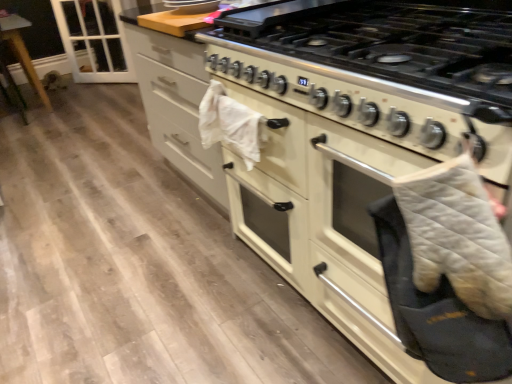
Measure the distance between point (368, 219) and camera.

They are 4.10 feet apart.

Image resolution: width=512 pixels, height=384 pixels. I want to click on gray quilted oven mitt at right, so click(457, 236).

What are the coordinates of `white glossy gas stove at center` in the screenshot? It's located at (389, 41).

Does white glossy gas stove at center have a lesser width compared to white quilted oven mitt at right?

No.

Considering the sizes of objects white glossy gas stove at center and white quilted oven mitt at right in the image provided, who is taller, white glossy gas stove at center or white quilted oven mitt at right?

Standing taller between the two is white quilted oven mitt at right.

Would you say white glossy gas stove at center is to the left or to the right of white quilted oven mitt at right in the picture?

From the image, it's evident that white glossy gas stove at center is to the right of white quilted oven mitt at right.

From the image's perspective, does white glossy gas stove at center appear higher than white quilted oven mitt at right?

Correct, white glossy gas stove at center appears higher than white quilted oven mitt at right in the image.

Could you tell me if transparent glass door at upper left is turned towards white quilted oven mitt at right?

No, transparent glass door at upper left is not aimed at white quilted oven mitt at right.

Considering the points (63, 11) and (371, 358), which point is in front, point (63, 11) or point (371, 358)?

The point (371, 358) is closer to the camera.

Is transparent glass door at upper left positioned far away from white quilted oven mitt at right?

Yes.

How far apart are transparent glass door at upper left and white quilted oven mitt at right?

A distance of 12.21 feet exists between transparent glass door at upper left and white quilted oven mitt at right.

Is gray quilted oven mitt at right far away from white quilted oven mitt at right?

No, there isn't a large distance between gray quilted oven mitt at right and white quilted oven mitt at right.

Considering the relative sizes of gray quilted oven mitt at right and white quilted oven mitt at right in the image provided, is gray quilted oven mitt at right taller than white quilted oven mitt at right?

No, gray quilted oven mitt at right is not taller than white quilted oven mitt at right.

Is transparent glass door at upper left turned away from white glossy gas stove at center?

transparent glass door at upper left is not turned away from white glossy gas stove at center.

From a real-world perspective, is transparent glass door at upper left on top of white glossy gas stove at center?

Actually, transparent glass door at upper left is physically below white glossy gas stove at center in the real world.

From the image's perspective, is transparent glass door at upper left over white glossy gas stove at center?

Yes, from the image's perspective, transparent glass door at upper left is above white glossy gas stove at center.

Does transparent glass door at upper left have a larger size compared to white glossy gas stove at center?

No.

Between white glossy gas stove at center and gray quilted oven mitt at right, which one has larger size?

white glossy gas stove at center.

I want to click on blanket below the white glossy gas stove at center (from a real-world perspective), so click(457, 236).

Does point (316, 20) come behind point (453, 222)?

Yes.

Is white quilted oven mitt at right far away from gray quilted oven mitt at right?

That's not correct — white quilted oven mitt at right is a little close to gray quilted oven mitt at right.

Is white quilted oven mitt at right wider than gray quilted oven mitt at right?

Correct, the width of white quilted oven mitt at right exceeds that of gray quilted oven mitt at right.

Considering the sizes of objects white quilted oven mitt at right and gray quilted oven mitt at right in the image provided, who is bigger, white quilted oven mitt at right or gray quilted oven mitt at right?

white quilted oven mitt at right is bigger.

Is white quilted oven mitt at right oriented towards gray quilted oven mitt at right?

Yes.

Is the depth of white glossy gas stove at center greater than that of transparent glass door at upper left?

That is False.

Considering the relative sizes of white glossy gas stove at center and transparent glass door at upper left in the image provided, is white glossy gas stove at center bigger than transparent glass door at upper left?

Correct, white glossy gas stove at center is larger in size than transparent glass door at upper left.

Considering the relative sizes of white glossy gas stove at center and transparent glass door at upper left in the image provided, is white glossy gas stove at center shorter than transparent glass door at upper left?

Yes.

Is white glossy gas stove at center at the left side of transparent glass door at upper left?

Incorrect, white glossy gas stove at center is not on the left side of transparent glass door at upper left.

Where is `oven located on the left of white glossy gas stove at center`? oven located on the left of white glossy gas stove at center is located at coordinates (357, 239).

Image resolution: width=512 pixels, height=384 pixels. In order to click on glass door behind the white quilted oven mitt at right in this screenshot , I will do `click(93, 40)`.

Which object lies nearer to the anchor point gray quilted oven mitt at right, white glossy gas stove at center or white quilted oven mitt at right?

white quilted oven mitt at right is positioned closer to the anchor gray quilted oven mitt at right.

When comparing their distances from transparent glass door at upper left, does gray quilted oven mitt at right or white glossy gas stove at center seem further?

gray quilted oven mitt at right is positioned further to the anchor transparent glass door at upper left.

From the image, which object appears to be nearer to gray quilted oven mitt at right, white glossy gas stove at center or transparent glass door at upper left?

Among the two, white glossy gas stove at center is located nearer to gray quilted oven mitt at right.

From the image, which object appears to be farther from white quilted oven mitt at right, white glossy gas stove at center or gray quilted oven mitt at right?

white glossy gas stove at center lies further to white quilted oven mitt at right than the other object.

Based on their spatial positions, is transparent glass door at upper left or white quilted oven mitt at right closer to gray quilted oven mitt at right?

white quilted oven mitt at right is closer to gray quilted oven mitt at right.

Estimate the real-world distances between objects in this image. Which object is further from transparent glass door at upper left, white quilted oven mitt at right or gray quilted oven mitt at right?

The object further to transparent glass door at upper left is gray quilted oven mitt at right.

Based on their spatial positions, is white quilted oven mitt at right or transparent glass door at upper left further from gray quilted oven mitt at right?

Among the two, transparent glass door at upper left is located further to gray quilted oven mitt at right.

From the image, which object appears to be nearer to white glossy gas stove at center, gray quilted oven mitt at right or transparent glass door at upper left?

gray quilted oven mitt at right is closer to white glossy gas stove at center.

Where is `gas stove located between gray quilted oven mitt at right and transparent glass door at upper left in the depth direction`? Image resolution: width=512 pixels, height=384 pixels. gas stove located between gray quilted oven mitt at right and transparent glass door at upper left in the depth direction is located at coordinates (389, 41).

Image resolution: width=512 pixels, height=384 pixels. What are the coordinates of `blanket between white glossy gas stove at center and white quilted oven mitt at right from top to bottom` in the screenshot? It's located at (457, 236).

Where is `gas stove between white quilted oven mitt at right and transparent glass door at upper left in the front-back direction`? gas stove between white quilted oven mitt at right and transparent glass door at upper left in the front-back direction is located at coordinates (389, 41).

Identify the location of blanket located between white quilted oven mitt at right and transparent glass door at upper left in the depth direction. The height and width of the screenshot is (384, 512). (457, 236).